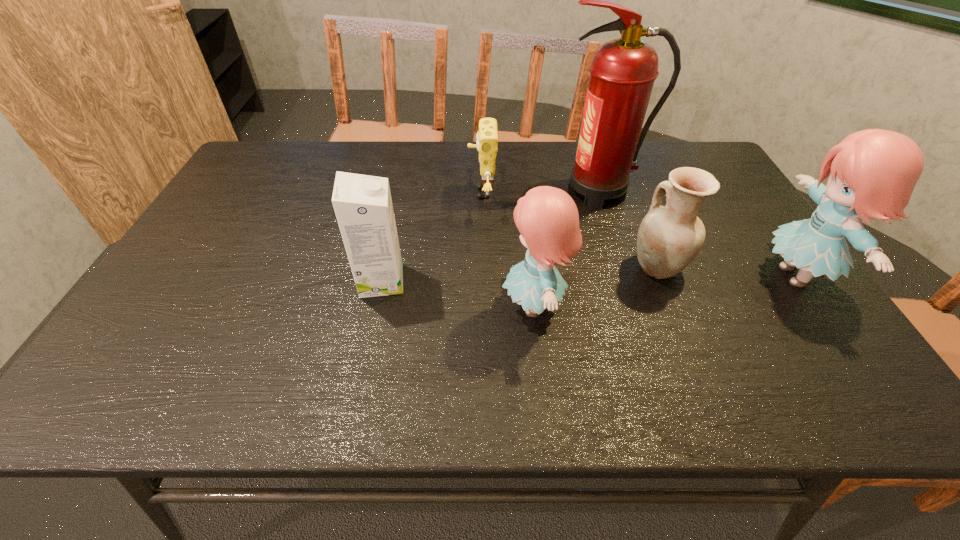
The width and height of the screenshot is (960, 540). What are the coordinates of `vacant space located on the face of the shortest object` in the screenshot? It's located at (334, 193).

Locate an element on the screen. The image size is (960, 540). vacant space situated 0.300m on the back of the pottery is located at coordinates (624, 181).

At what (x,y) coordinates should I click in order to perform the action: click on free point located 0.400m on the back of the leftmost object. Please return your answer as a coordinate pair (x, y). Image resolution: width=960 pixels, height=540 pixels. Looking at the image, I should click on (404, 176).

The image size is (960, 540). Find the location of `fire extinguisher that is at the far edge`. fire extinguisher that is at the far edge is located at coordinates 623,71.

Locate an element on the screen. The image size is (960, 540). sponge situated at the far edge is located at coordinates (487, 137).

This screenshot has height=540, width=960. Identify the location of object that is at the right edge. coord(872,173).

Locate an element on the screen. The width and height of the screenshot is (960, 540). object that is positioned at the near right corner is located at coordinates (872, 173).

Identify the location of vacant space at the far edge of the desktop. (540, 180).

In the image, there is a desktop. What are the coordinates of `free space at the near edge` in the screenshot? It's located at (547, 355).

The width and height of the screenshot is (960, 540). What are the coordinates of `vacant space at the left edge` in the screenshot? It's located at (204, 275).